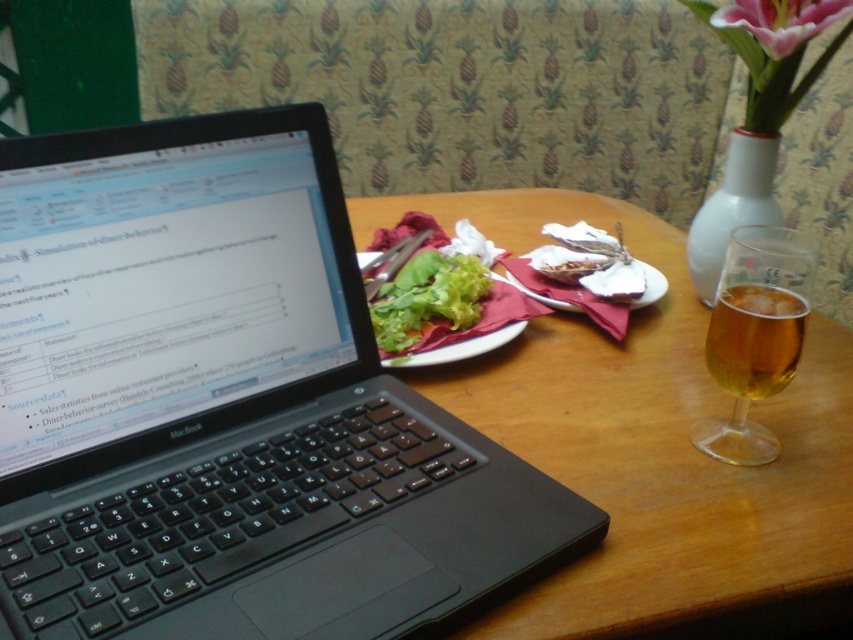
You are sitting at the dining table and want to reach the black plastic laptop at left without moving your chair. Can you comfortably reach it if your arm can extend 16 inches?

The black plastic laptop at left is 16.21 inches away from viewer. Since your arm can extend 16 inches, you might not be able to comfortably reach it as the distance is slightly longer than your arm extension.

You are a delivery robot with a package that needs to be placed between the black plastic laptop at left and the white glossy vase at upper right. The package is 18 inches long. Can the package fit in the space between them?

The distance between the black plastic laptop at left and the white glossy vase at upper right is 20.74 inches. Since the package is 18 inches long, it can fit in the space between them as there is enough room.

From the picture: You are organizing a study session and need to place a textbook between the black plastic laptop at left and the translucent amber liquid at right on the table. Considering their sizes, which object should the textbook be placed closer to?

The black plastic laptop at left is larger in size than the translucent amber liquid at right, so the textbook should be placed closer to the translucent amber liquid at right to ensure enough space around the larger laptop.